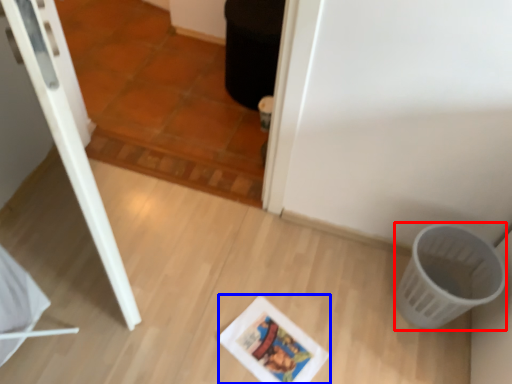
Question: Which point is closer to the camera, basket (highlighted by a red box) or comic book (highlighted by a blue box)?

Choices:
 (A) basket
 (B) comic book

Answer: (A)